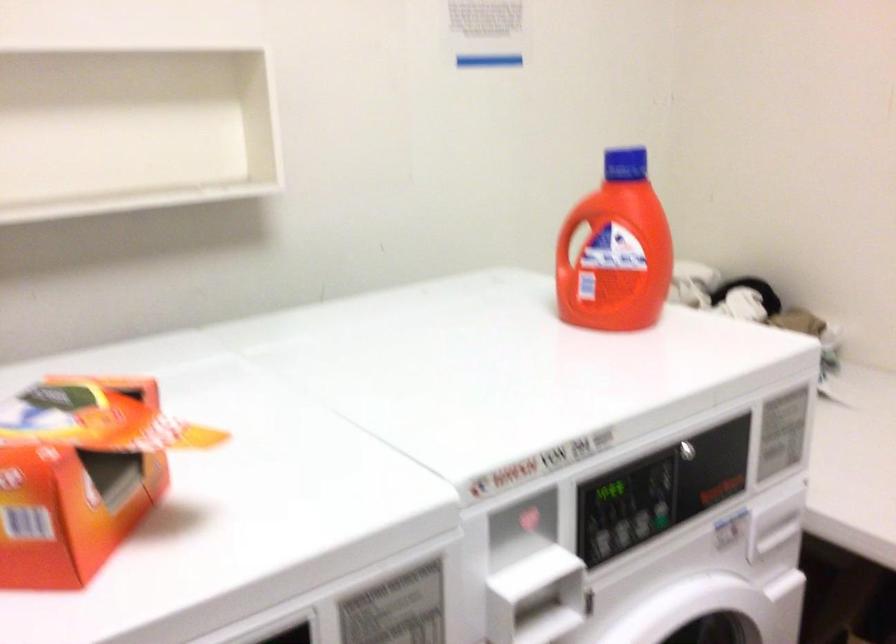
Find the location of `orange cardboard box`. orange cardboard box is located at coordinates (73, 498).